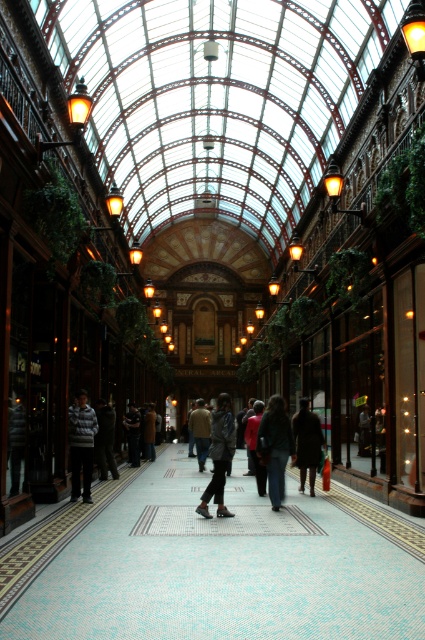
The height and width of the screenshot is (640, 425). Describe the element at coordinates (220, 456) in the screenshot. I see `dark gray fabric jacket at center` at that location.

Who is higher up, dark gray fabric jacket at center or dark brown leather jacket at center?

dark gray fabric jacket at center is above.

Between point (218, 396) and point (135, 465), which one is positioned behind?

Positioned behind is point (218, 396).

You are a GUI agent. You are given a task and a screenshot of the screen. Output one action in this format:
    pyautogui.click(x=<x>, y=<y>)
    Task: Click on the dark gray fabric jacket at center
    The width and height of the screenshot is (425, 640).
    Given the screenshot: What is the action you would take?
    pyautogui.click(x=220, y=456)

Can you confirm if dark gray fabric jacket at center is shorter than red fabric jacket at center?

Incorrect, dark gray fabric jacket at center's height does not fall short of red fabric jacket at center's.

Does point (231, 513) lie behind point (252, 460)?

No, it is not.

The height and width of the screenshot is (640, 425). Identify the location of dark gray fabric jacket at center. (220, 456).

Between point (224, 451) and point (144, 428), which one is positioned behind?

The point (144, 428) is behind.

Who is more forward, (232, 417) or (146, 420)?

Point (232, 417)

Where is `dark gray fabric jacket at center`? dark gray fabric jacket at center is located at coordinates (220, 456).